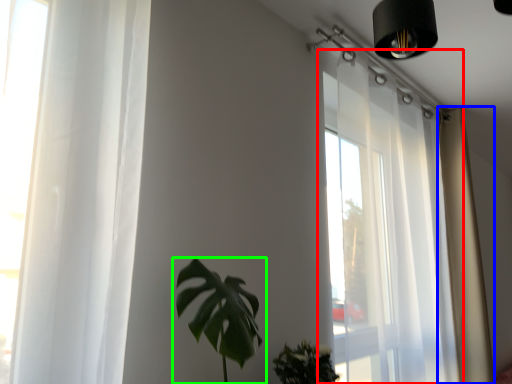
Question: Which object is the farthest from window (highlighted by a red box)? Choose among these: curtain (highlighted by a blue box) or houseplant (highlighted by a green box).

Choices:
 (A) curtain
 (B) houseplant

Answer: (B)